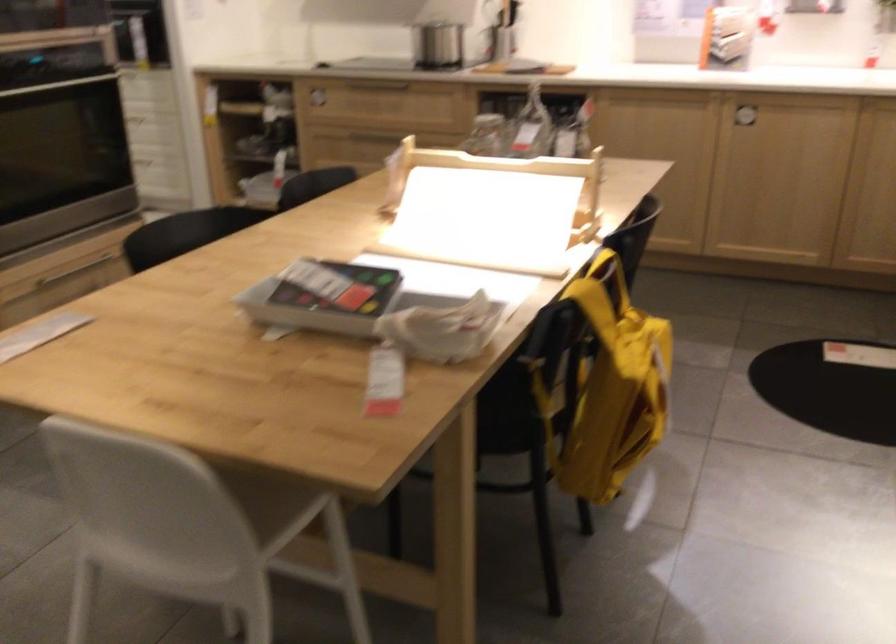
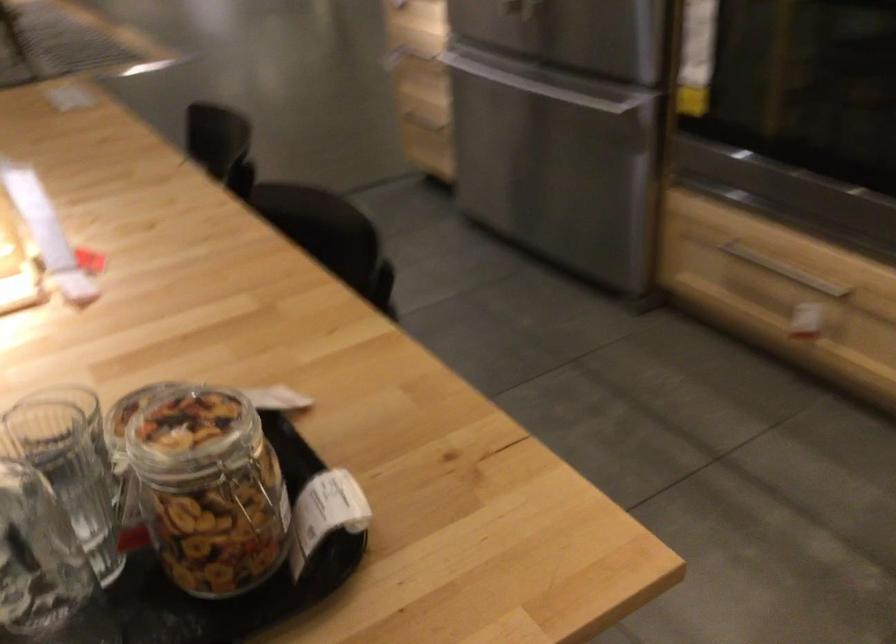
The point at [490,124] is marked in the first image. Where is the corresponding point in the second image?

(209, 489)